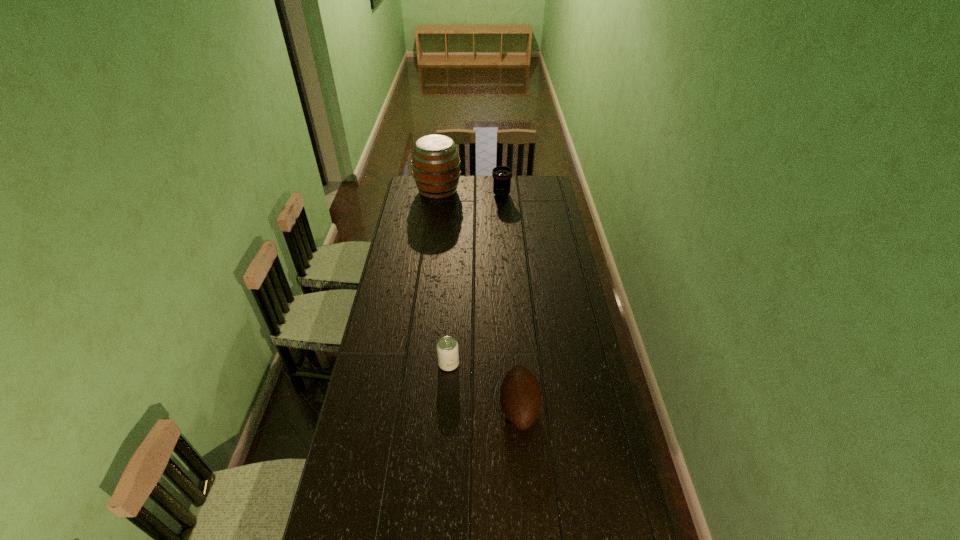
Find the location of a particular element. cider that is at the far edge is located at coordinates (436, 166).

Image resolution: width=960 pixels, height=540 pixels. I want to click on telephoto lens that is at the far edge, so click(x=502, y=175).

Find the location of a particular element. This screenshot has height=540, width=960. object located in the left edge section of the desktop is located at coordinates (436, 166).

Identify the location of object at the far left corner. (436, 166).

The height and width of the screenshot is (540, 960). What are the coordinates of `free spot at the left edge of the desktop` in the screenshot? It's located at (413, 210).

In the image, there is a desktop. Where is `vacant space at the right edge`? This screenshot has width=960, height=540. vacant space at the right edge is located at coordinates click(549, 263).

The height and width of the screenshot is (540, 960). What are the coordinates of `free space between the tallest object and the telephoto lens` in the screenshot? It's located at (469, 193).

Locate an element on the screen. This screenshot has width=960, height=540. vacant space that is in between the telephoto lens and the tallest object is located at coordinates (469, 193).

At what (x,y) coordinates should I click in order to perform the action: click on vacant space in between the telephoto lens and the nearest object. Please return your answer as a coordinate pair (x, y). The width and height of the screenshot is (960, 540). Looking at the image, I should click on (511, 301).

This screenshot has height=540, width=960. I want to click on vacant region between the second nearest object and the nearest object, so click(x=484, y=386).